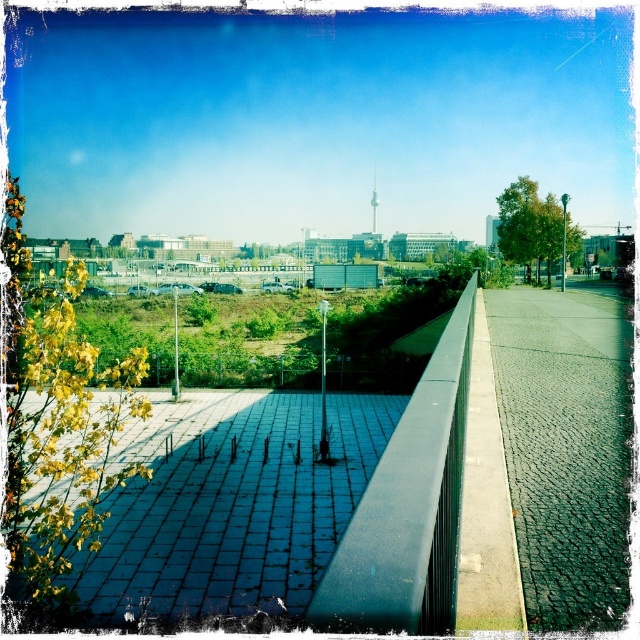
Is point (220, 512) closer to camera compared to point (596, 518)?

No, (220, 512) is further to viewer.

From the picture: Is dark gray paving stone at center taller than cobblestone pavement at center?

No.

Does point (230, 529) lie in front of point (625, 515)?

No.

You are a GUI agent. You are given a task and a screenshot of the screen. Output one action in this format:
    pyautogui.click(x=<x>, y=<y>)
    Task: Click on the dark gray paving stone at center
    Image resolution: width=640 pixels, height=640 pixels.
    Given the screenshot: What is the action you would take?
    pyautogui.click(x=230, y=504)

Does point (346, 538) come closer to viewer compared to point (372, 218)?

Yes.

Is black metal ledge at center wider than white glass tv tower at center?

In fact, black metal ledge at center might be narrower than white glass tv tower at center.

Between point (412, 580) and point (376, 182), which one is positioned in front?

Point (412, 580) is more forward.

Where is `black metal ledge at center`? black metal ledge at center is located at coordinates (408, 508).

Is dark gray paving stone at center to the right of white glass tv tower at center from the viewer's perspective?

In fact, dark gray paving stone at center is to the left of white glass tv tower at center.

You are a GUI agent. You are given a task and a screenshot of the screen. Output one action in this format:
    pyautogui.click(x=<x>, y=<y>)
    Task: Click on the dark gray paving stone at center
    The width and height of the screenshot is (640, 640).
    Given the screenshot: What is the action you would take?
    pyautogui.click(x=230, y=504)